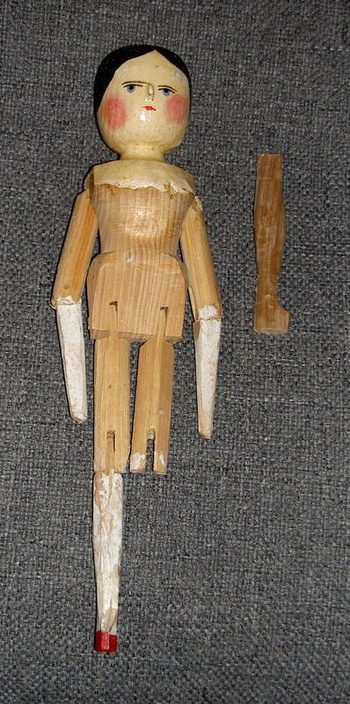
At what (x,y) coordinates should I click in order to perform the action: click on carpet. Please return your answer as a coordinate pair (x, y). Looking at the image, I should click on (293, 106).